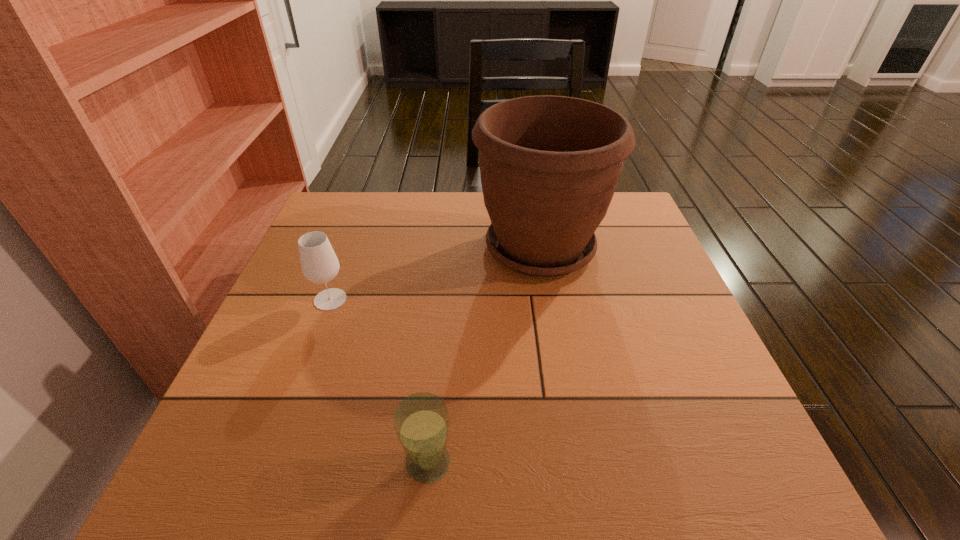
Identify the location of object that is at the near edge. (421, 421).

You are a GUI agent. You are given a task and a screenshot of the screen. Output one action in this format:
    pyautogui.click(x=<x>, y=<y>)
    Task: Click on the object present at the left edge
    The width and height of the screenshot is (960, 540).
    Given the screenshot: What is the action you would take?
    pyautogui.click(x=319, y=263)

You are a GUI agent. You are given a task and a screenshot of the screen. Output one action in this format:
    pyautogui.click(x=<x>, y=<y>)
    Task: Click on the object that is at the right edge
    
    Given the screenshot: What is the action you would take?
    pyautogui.click(x=549, y=165)

In order to click on object situated at the far right corner in this screenshot , I will do `click(549, 165)`.

In the image, there is a desktop. What are the coordinates of `vacant space at the far edge` in the screenshot? It's located at (471, 201).

The height and width of the screenshot is (540, 960). Find the location of `vacant area at the left edge`. vacant area at the left edge is located at coordinates (296, 269).

At what (x,y) coordinates should I click in order to perform the action: click on vacant area at the right edge. Please return your answer as a coordinate pair (x, y). Looking at the image, I should click on (607, 282).

The image size is (960, 540). Find the location of `free spot at the far left corner of the desktop`. free spot at the far left corner of the desktop is located at coordinates point(380,200).

Identify the location of free space between the shortest object and the rightmost object. (484, 355).

Image resolution: width=960 pixels, height=540 pixels. Find the location of `free space between the nearest object and the rightmost object`. free space between the nearest object and the rightmost object is located at coordinates (484, 355).